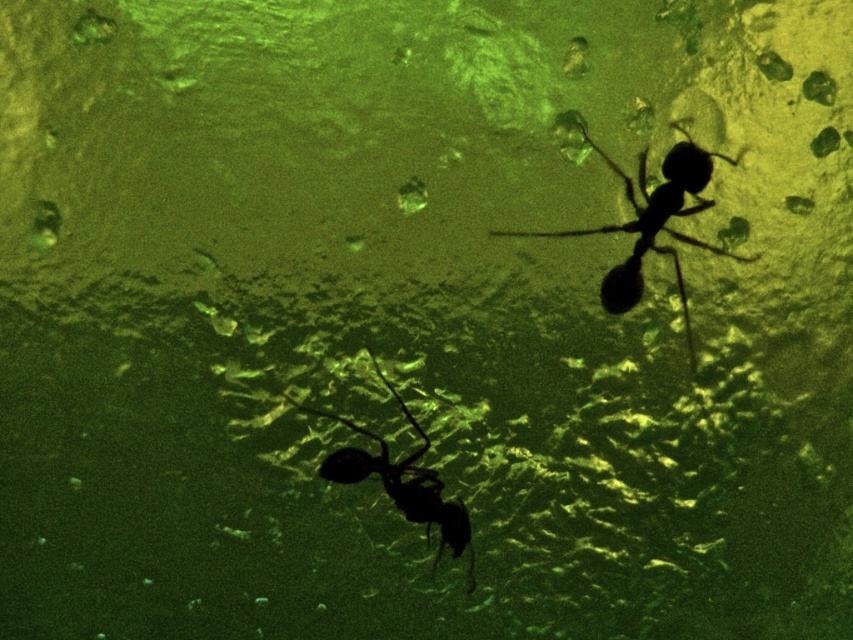
Does black matte ant at upper right have a smaller size compared to black matte ant at lower center?

Incorrect, black matte ant at upper right is not smaller in size than black matte ant at lower center.

Is black matte ant at upper right bigger than black matte ant at lower center?

Yes, black matte ant at upper right is bigger than black matte ant at lower center.

Who is more distant from viewer, (637, 237) or (408, 483)?

The point (637, 237) is more distant.

I want to click on black matte ant at upper right, so click(x=653, y=221).